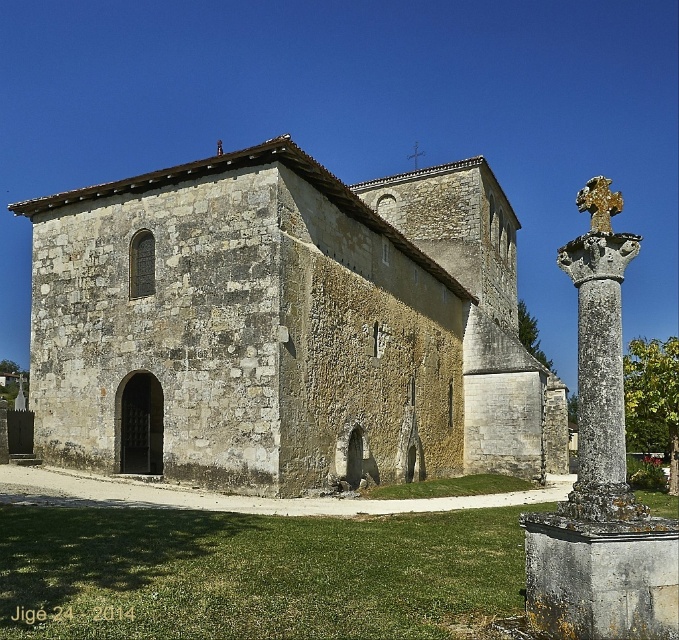
You are standing in front of the historic stone church and want to determine the relative positions of two points marked on the building. The points are labeled as point 1 at coordinates point (581, 372) and point 2 at coordinates point (623, 444). Which point is closer to you?

Point (581, 372) is closer to you because it is further to the viewer than point (623, 444).